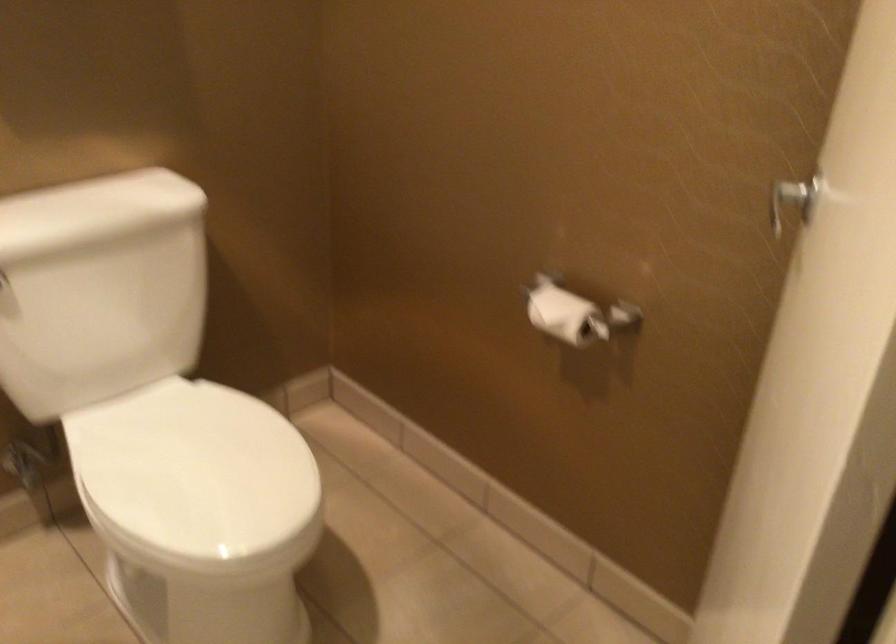
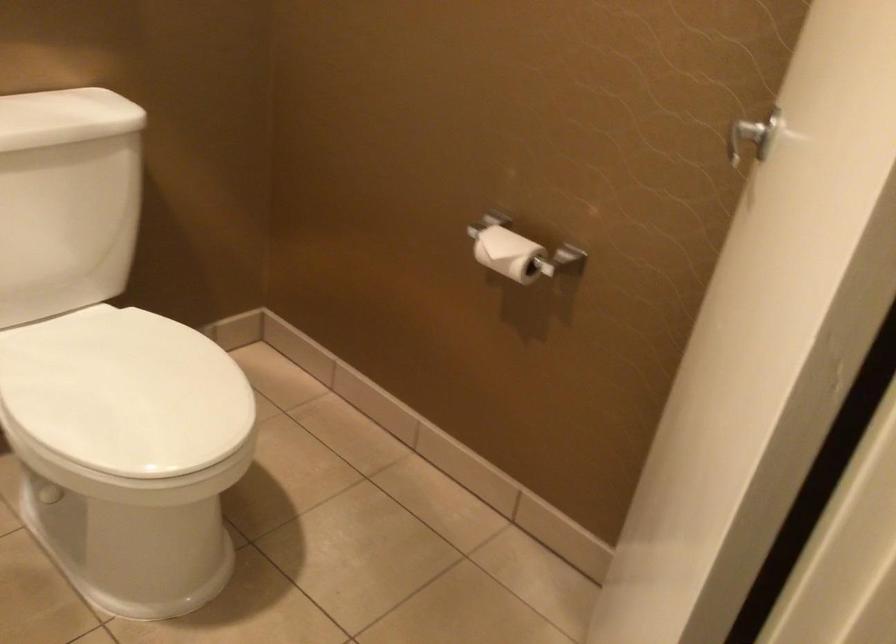
In the second image, find the point that corresponds to [563,316] in the first image.

(507, 252)